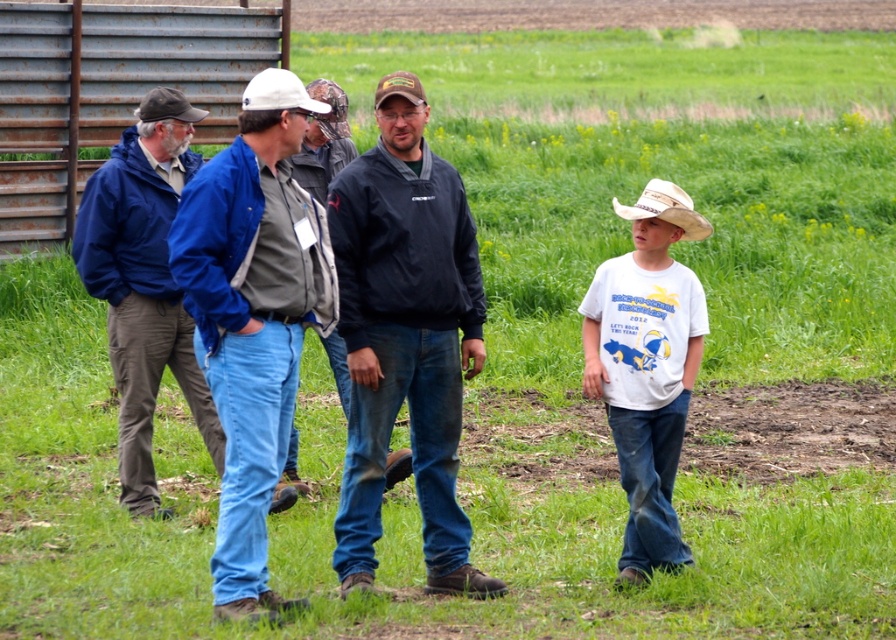
What do you see at coordinates (647, 368) in the screenshot?
I see `white cotton shirt at right` at bounding box center [647, 368].

Find the location of a particular element. This screenshot has height=640, width=896. white cotton shirt at right is located at coordinates (647, 368).

Describe the element at coordinates (647, 368) in the screenshot. Image resolution: width=896 pixels, height=640 pixels. I see `white cotton shirt at right` at that location.

At what (x,y) coordinates should I click in order to perform the action: click on white cotton shirt at right. Please return your answer as a coordinate pair (x, y). Looking at the image, I should click on (647, 368).

Between white straw hat at right and brown fabric cowboy hat at upper left, which one has more height?

white straw hat at right

Is white straw hat at right to the left of brown fabric cowboy hat at upper left from the viewer's perspective?

No, white straw hat at right is not to the left of brown fabric cowboy hat at upper left.

Who is more distant from viewer, (670,200) or (162,97)?

Point (162,97)

Find the location of a particular element. The image size is (896, 640). white straw hat at right is located at coordinates (666, 209).

Is blue denim jeans at left wider than brown fabric cowboy hat at upper left?

Indeed, blue denim jeans at left has a greater width compared to brown fabric cowboy hat at upper left.

Between point (106, 232) and point (151, 108), which one is positioned behind?

The point (106, 232) is behind.

Who is more distant from viewer, (110, 212) or (135, 115)?

The point (135, 115) is behind.

The width and height of the screenshot is (896, 640). I want to click on blue denim jeans at left, so click(142, 292).